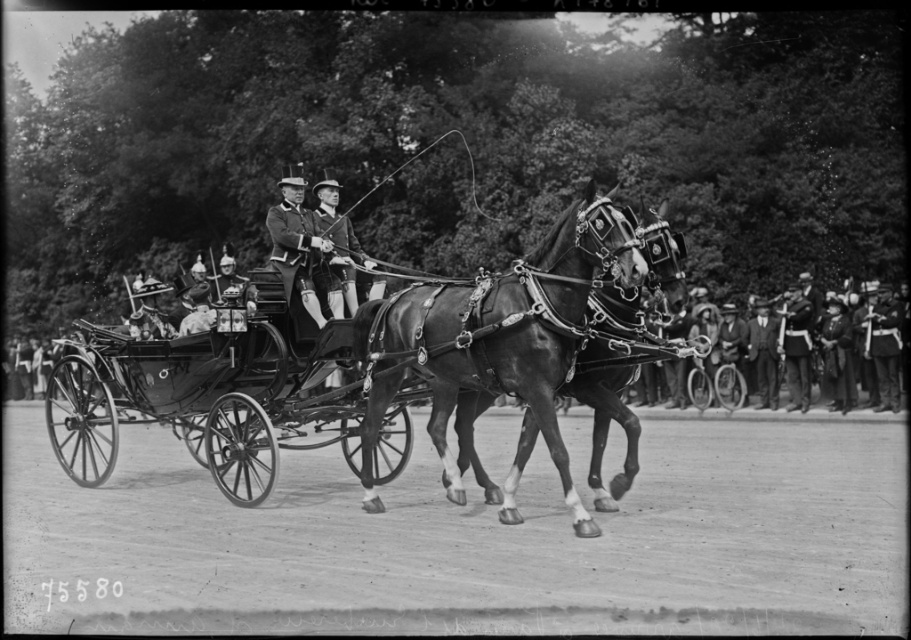
Based on the photo, can you confirm if shiny black horse at center is positioned to the left of smooth leather hat at center?

No, shiny black horse at center is not to the left of smooth leather hat at center.

Who is higher up, shiny black horse at center or smooth leather hat at center?

Positioned higher is smooth leather hat at center.

Measure the distance between point (662,280) and camera.

Point (662,280) and camera are 39.87 feet apart.

Identify the location of shiny black horse at center. (606, 413).

Between smooth leather jacket at right and shiny black uniform at center, which one is positioned higher?

Positioned higher is shiny black uniform at center.

Is smooth leather jacket at right smaller than shiny black uniform at center?

Incorrect, smooth leather jacket at right is not smaller in size than shiny black uniform at center.

This screenshot has width=911, height=640. What are the coordinates of `smooth leather jacket at right` in the screenshot? It's located at (865, 346).

Who is lower down, shiny black horse at center or shiny black uniform at center?

Positioned lower is shiny black horse at center.

Is point (592, 486) more distant than point (280, 252)?

No, (592, 486) is in front of (280, 252).

The height and width of the screenshot is (640, 911). I want to click on shiny black horse at center, so click(x=606, y=413).

In order to click on shiny black horse at center in this screenshot , I will do `click(606, 413)`.